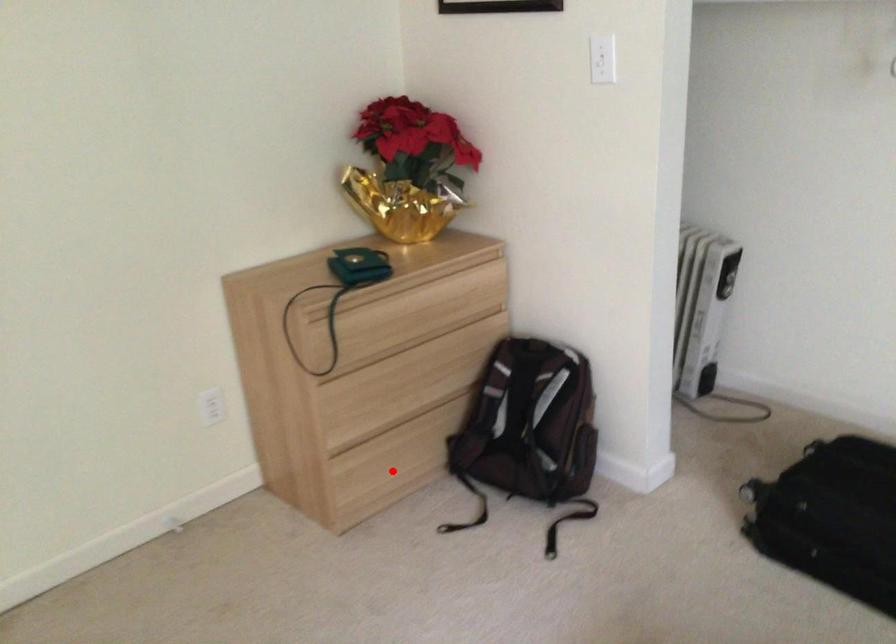
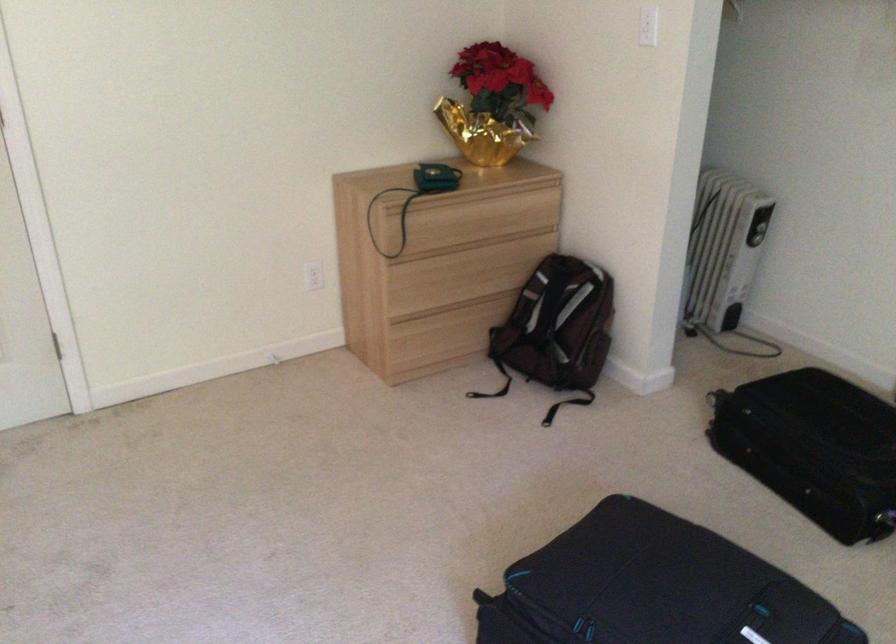
In the second image, find the point that corresponds to the highlighted location in the first image.

(442, 345)